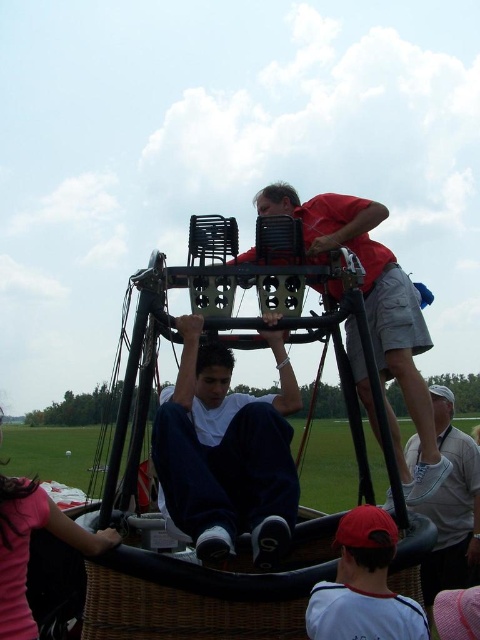
You are a photographer positioned to the side of the hot air balloon basket. You want to capture a photo that includes both the red shirt at upper center and the gray fabric cap at lower right. Based on their positions, which object should you adjust your camera to focus on first to ensure both are in frame?

Since the red shirt at upper center is to the left of the gray fabric cap at lower right, you should first focus on the gray fabric cap at lower right to ensure both are in frame.

You are a photographer positioned at the front of the hot air balloon basket. You want to take a photo of the red shirt at upper center and the gray fabric cap at lower right. Which object will appear larger in your photo?

The red shirt at upper center will appear larger in the photo because it is closer to the viewer than the gray fabric cap at lower right.

You are a photographer positioned at the center of the image. You want to take a photo of the matte red cap at lower center. Where should you point your camera relative to the center of the image?

The matte red cap at lower center is located at coordinates approximately 0.916 on the x axis and 0.758 on the y axis relative to the center of the image. To capture it, aim your camera slightly to the right and upwards from the center point.